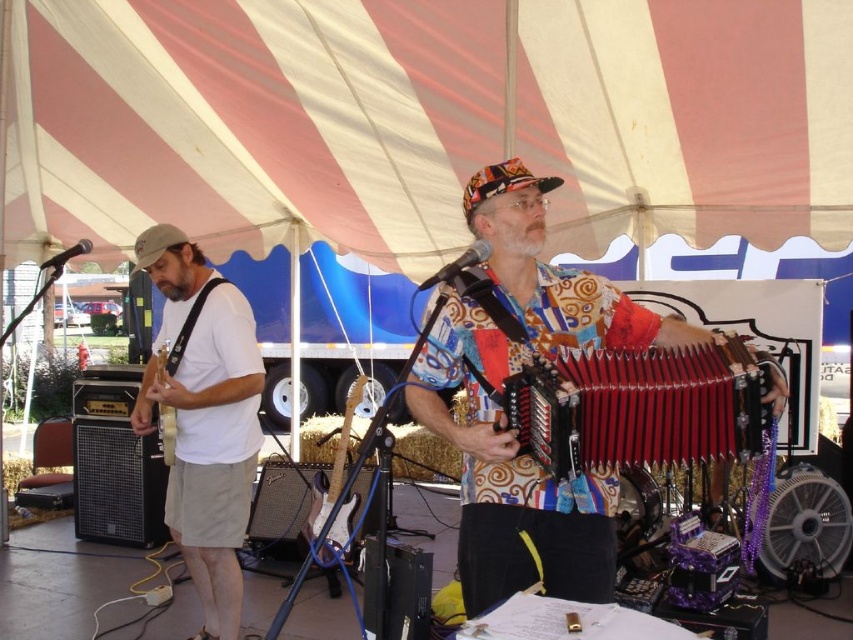
Is point (169, 269) behind point (158, 419)?

That is False.

Is brown matte beard at left thinner than wooden electric guitar at left?

In fact, brown matte beard at left might be wider than wooden electric guitar at left.

Who is more forward, (x=165, y=275) or (x=165, y=444)?

Positioned in front is point (x=165, y=275).

Find the location of a particular element. This screenshot has width=853, height=640. brown matte beard at left is located at coordinates (175, 275).

Who is lower down, multicolored fabric hat at center or white matte beard at center?

white matte beard at center

Is multicolored fabric hat at center to the left of white matte beard at center from the viewer's perspective?

Correct, you'll find multicolored fabric hat at center to the left of white matte beard at center.

Image resolution: width=853 pixels, height=640 pixels. What do you see at coordinates (502, 182) in the screenshot?
I see `multicolored fabric hat at center` at bounding box center [502, 182].

Find the location of a particular element. multicolored fabric hat at center is located at coordinates (502, 182).

Who is positioned more to the right, multicolored fabric shirt at center or white matte guitar at left?

From the viewer's perspective, multicolored fabric shirt at center appears more on the right side.

Locate an element on the screen. multicolored fabric shirt at center is located at coordinates (508, 476).

You are a GUI agent. You are given a task and a screenshot of the screen. Output one action in this format:
    pyautogui.click(x=<x>, y=<y>)
    Task: Click on the multicolored fabric shirt at center
    This screenshot has width=853, height=640.
    Given the screenshot: What is the action you would take?
    pyautogui.click(x=508, y=476)